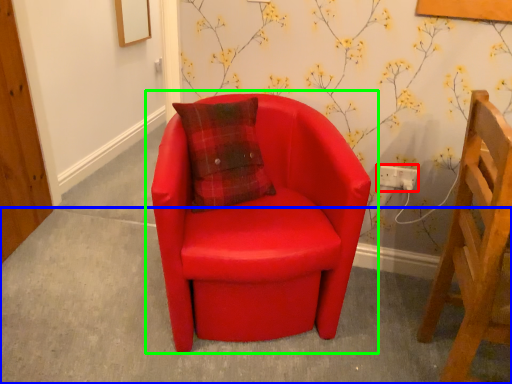
Question: Based on their relative distances, which object is farther from electric outlet (highlighted by a red box)? Choose from concrete (highlighted by a blue box) and chair (highlighted by a green box).

Choices:
 (A) concrete
 (B) chair

Answer: (A)